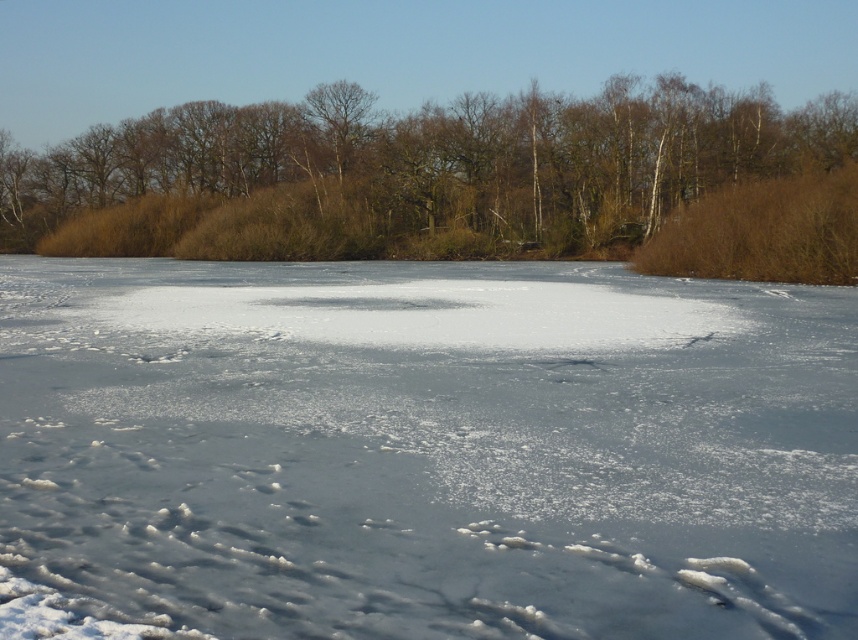
You are standing on the frozen lake in the winter landscape scene. You notice a specific point marked at coordinates point [421,451]. Based on the scene description, can you determine what surface this point is located on?

The point [421,451] is located on white frosty ice at center, as stated in the objects description.